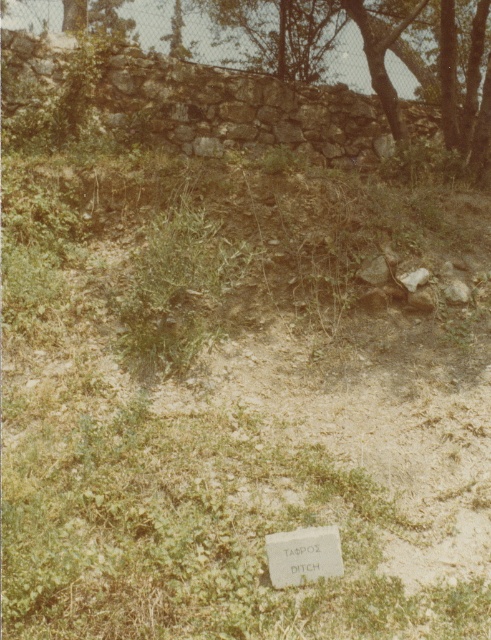
You are standing at the point marked as point (285, 76) in the image. Which direction should you walk to reach the dark green leafy tree at upper center?

The dark green leafy tree at upper center is located at point (285, 76), so you are already at its location.

You are an archaeologist examining the site. You notice the dark green leafy tree at upper center and the white stone plaque at center. Which object is closer to you?

The dark green leafy tree at upper center is closer to you than the white stone plaque at center.